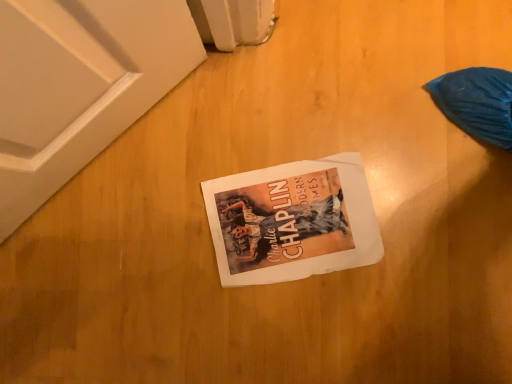
This screenshot has width=512, height=384. In order to click on free space above white paper book at center (from a real-world perspective) in this screenshot , I will do `click(295, 220)`.